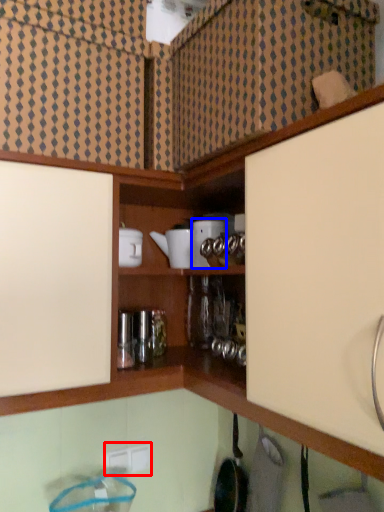
Question: Which of the following is the closest to the observer, electric outlet (highlighted by a red box) or appliance (highlighted by a blue box)?

Choices:
 (A) electric outlet
 (B) appliance

Answer: (B)